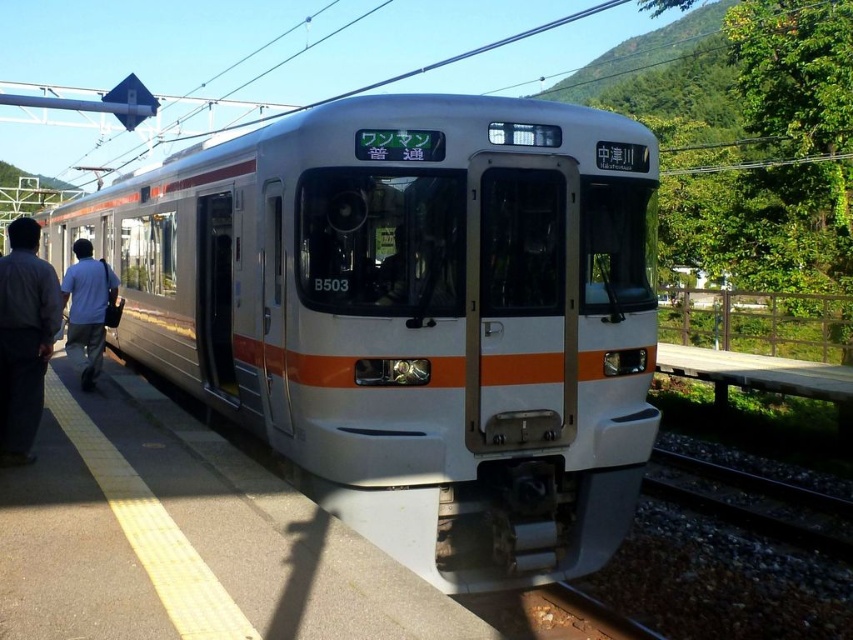
Is white glossy train at center above dark gray fabric pants at left?

Yes.

Which is in front, point (276, 349) or point (16, 452)?

Point (16, 452) is in front.

Who is more forward, [370,209] or [35,317]?

Point [370,209] is more forward.

Image resolution: width=853 pixels, height=640 pixels. I want to click on white glossy train at center, so click(410, 316).

Looking at this image, does white glossy train at center have a larger size compared to light blue shirt at left?

Yes.

Who is more distant from viewer, (164, 177) or (99, 273)?

The point (164, 177) is behind.

Who is more distant from viewer, (x=142, y=230) or (x=96, y=353)?

The point (x=142, y=230) is more distant.

Where is `white glossy train at center`? white glossy train at center is located at coordinates (410, 316).

From the picture: Is dark gray fabric pants at left taller than light blue shirt at left?

In fact, dark gray fabric pants at left may be shorter than light blue shirt at left.

Who is shorter, dark gray fabric pants at left or light blue shirt at left?

With less height is dark gray fabric pants at left.

You are a GUI agent. You are given a task and a screenshot of the screen. Output one action in this format:
    pyautogui.click(x=<x>, y=<y>)
    Task: Click on the dark gray fabric pants at left
    The image size is (853, 640).
    Given the screenshot: What is the action you would take?
    pyautogui.click(x=24, y=339)

This screenshot has width=853, height=640. Find the location of `dark gray fabric pants at left`. dark gray fabric pants at left is located at coordinates (24, 339).